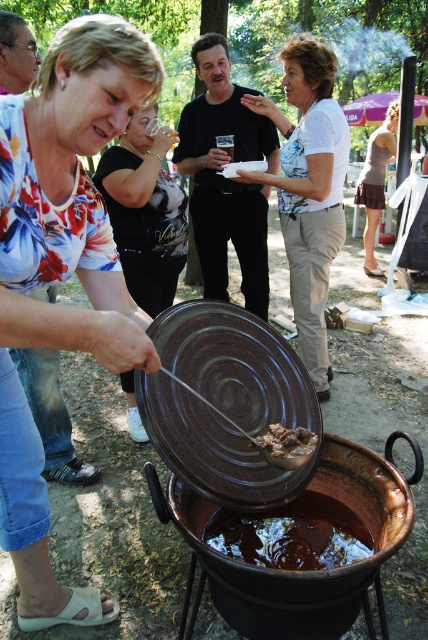
Question: Is white floral blouse at center positioned in front of brown glossy liquid at center?

Choices:
 (A) no
 (B) yes

Answer: (A)

Question: Considering the real-world distances, which object is closest to the black matte pot at center?

Choices:
 (A) black fabric shirt at upper left
 (B) brown matte food at center

Answer: (A)

Question: Which of the following is the farthest from the observer?

Choices:
 (A) (258, 524)
 (B) (48, 88)

Answer: (A)

Question: Which object appears farthest from the camera in this image?

Choices:
 (A) black matte pot at center
 (B) black fabric shirt at upper left
 (C) white floral blouse at center
 (D) brown glossy liquid at center

Answer: (A)

Question: Is the position of black matte pot at center less distant than that of brown glossy liquid at center?

Choices:
 (A) no
 (B) yes

Answer: (A)

Question: Can you confirm if black matte pot at center is positioned below brown matte food at center?

Choices:
 (A) yes
 (B) no

Answer: (B)